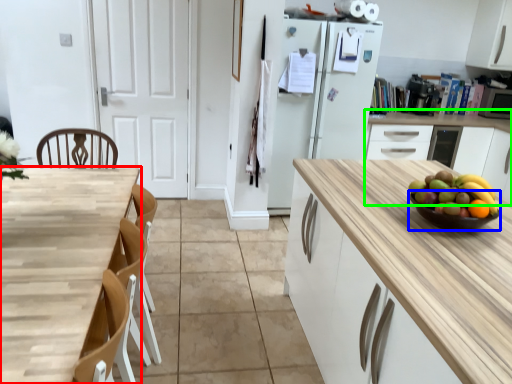
Question: Considering the real-world distances, which object is farthest from countertop (highlighted by a red box)? glass bowl (highlighted by a blue box) or cabinetry (highlighted by a green box)?

Choices:
 (A) glass bowl
 (B) cabinetry

Answer: (B)